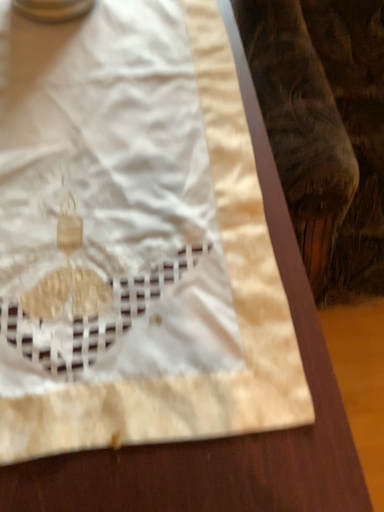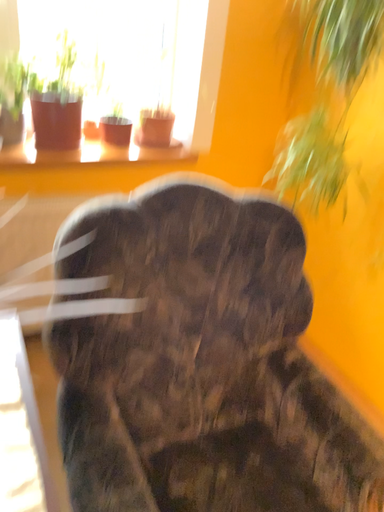
Question: How did the camera likely rotate when shooting the video?

Choices:
 (A) rotated left
 (B) rotated right

Answer: (B)